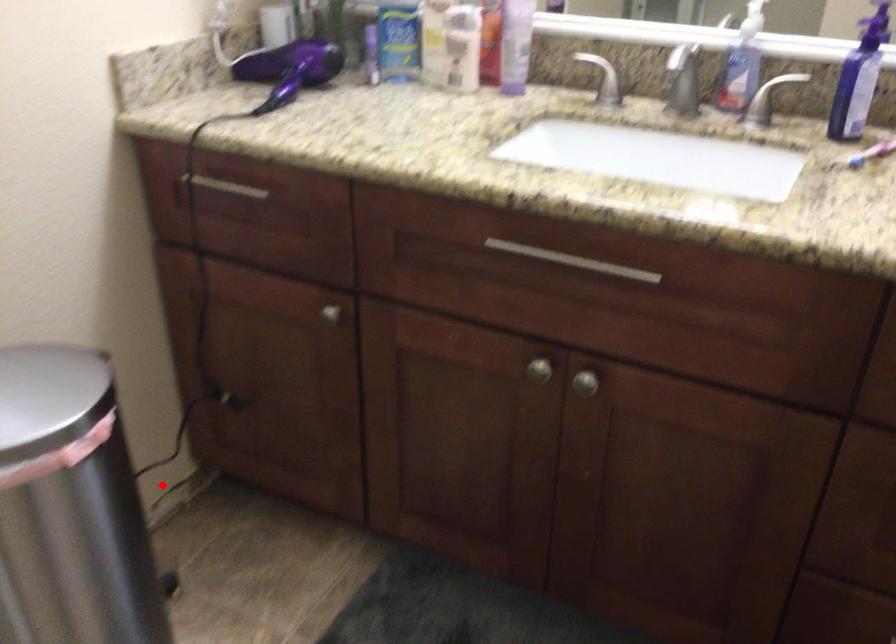
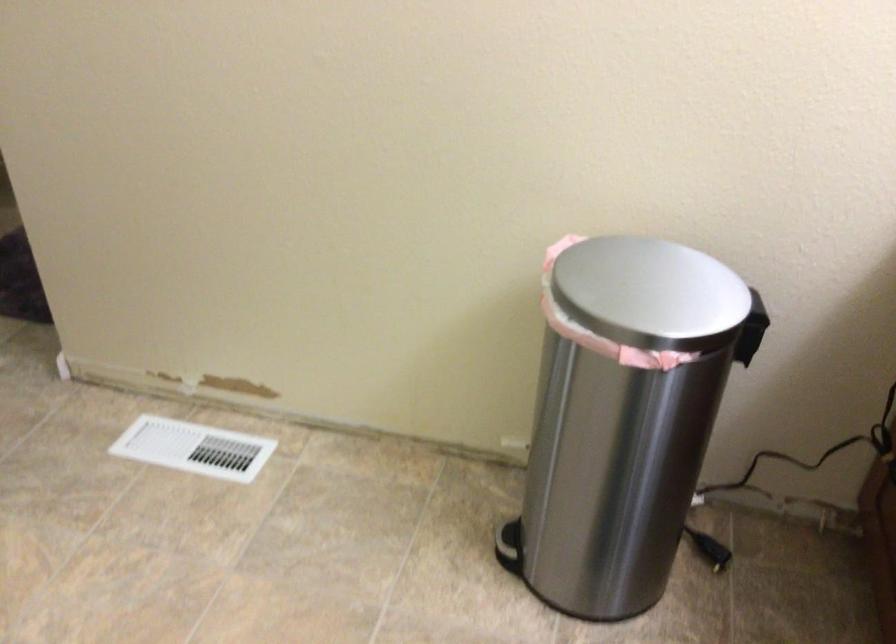
Question: I am providing you with two images of the same scene from different viewpoints. A red point is marked on the first image. Is the red point's position out of view in image 2?

Choices:
 (A) Yes
 (B) No

Answer: (B)